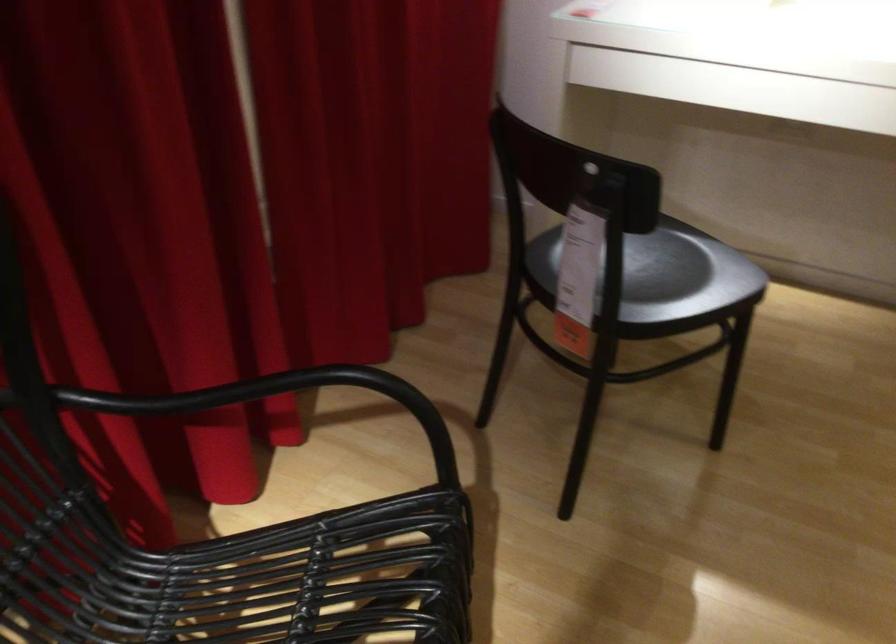
The height and width of the screenshot is (644, 896). What do you see at coordinates (259, 395) in the screenshot?
I see `the black chair armrest` at bounding box center [259, 395].